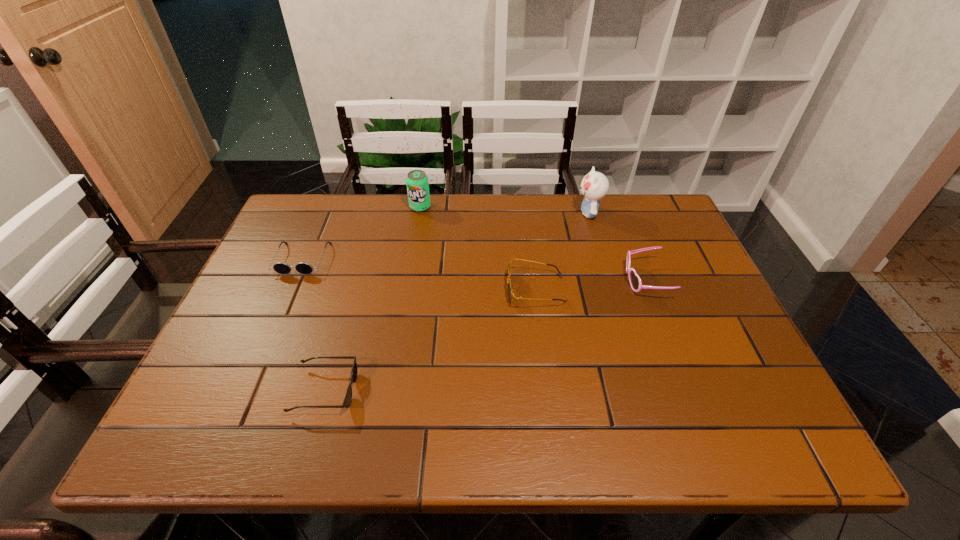
Locate an element on the screen. empty space between the leftmost sunglasses and the rightmost object is located at coordinates pos(474,270).

The width and height of the screenshot is (960, 540). Identify the location of the fourth closest object to the third sunglasses from right to left. (635, 281).

Image resolution: width=960 pixels, height=540 pixels. Find the location of `object that ranks as the third closest to the pop soda`. object that ranks as the third closest to the pop soda is located at coordinates (594, 186).

Locate which sunglasses ranks second in proximity to the kitten. Please provide its 2D coordinates. Your answer should be formatted as a tuple, i.e. [(x, y)], where the tuple contains the x and y coordinates of a point satisfying the conditions above.

[(510, 286)]

Find the location of a particular element. The image size is (960, 540). sunglasses that can be found as the closest to the rightmost object is located at coordinates (510, 286).

At what (x,y) coordinates should I click in order to perform the action: click on free space that satisfies the following two spatial constraints: 1. on the front-facing side of the kitten; 2. on the front-facing side of the leftmost sunglasses. Please return your answer as a coordinate pair (x, y). The height and width of the screenshot is (540, 960). Looking at the image, I should click on (602, 259).